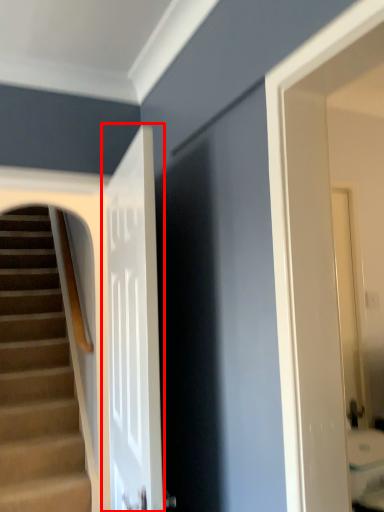
Question: From the image, what is the correct spatial relationship of door (annotated by the red box) in relation to stairs?

Choices:
 (A) left
 (B) right

Answer: (B)